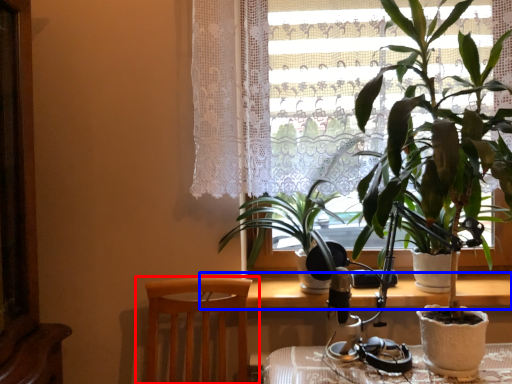
Question: Which of the following is the closest to the observer, chair (highlighted by a red box) or table (highlighted by a blue box)?

Choices:
 (A) chair
 (B) table

Answer: (A)